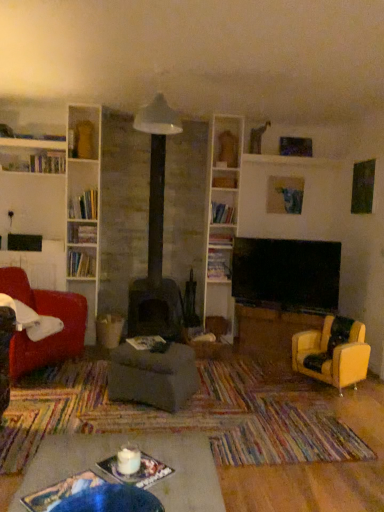
Question: Considering the relative positions of velvet red armchair at left, which is counted as the 1th chair, starting from the left, and yellow leather armchair at right, acting as the second chair starting from the left, in the image provided, is velvet red armchair at left, which is counted as the 1th chair, starting from the left, to the left or to the right of yellow leather armchair at right, acting as the second chair starting from the left,?

Choices:
 (A) right
 (B) left

Answer: (B)

Question: In the image, is velvet red armchair at left, placed as the second chair when sorted from right to left, positioned in front of or behind yellow leather armchair at right, the first chair when ordered from right to left?

Choices:
 (A) front
 (B) behind

Answer: (A)

Question: Considering the real-world distances, which object is closest to the wooden bookshelf at upper center, marked as the 4th shelf in a left-to-right arrangement?

Choices:
 (A) white glossy bookshelf at upper left, which is the third shelf from top to bottom
 (B) yellow leather armchair at right, the first chair when ordered from right to left
 (C) matte blue painting at upper center
 (D) dark gray fabric footrest at center
 (E) white glossy bookshelf at upper center, positioned as the third shelf in bottom-to-top order

Answer: (E)

Question: Which object is positioned closest to the white glossy bookshelf at upper center, positioned as the third shelf in bottom-to-top order?

Choices:
 (A) wooden bookshelf at upper center, arranged as the 4th shelf when ordered from the bottom
 (B) dark gray fabric footrest at center
 (C) yellow leather armchair at right, acting as the second chair starting from the left
 (D) white glossy bookshelf at upper left, the 1th shelf in the left-to-right sequence
 (E) wooden bookshelf at center, the first shelf in the bottom-to-top sequence

Answer: (E)